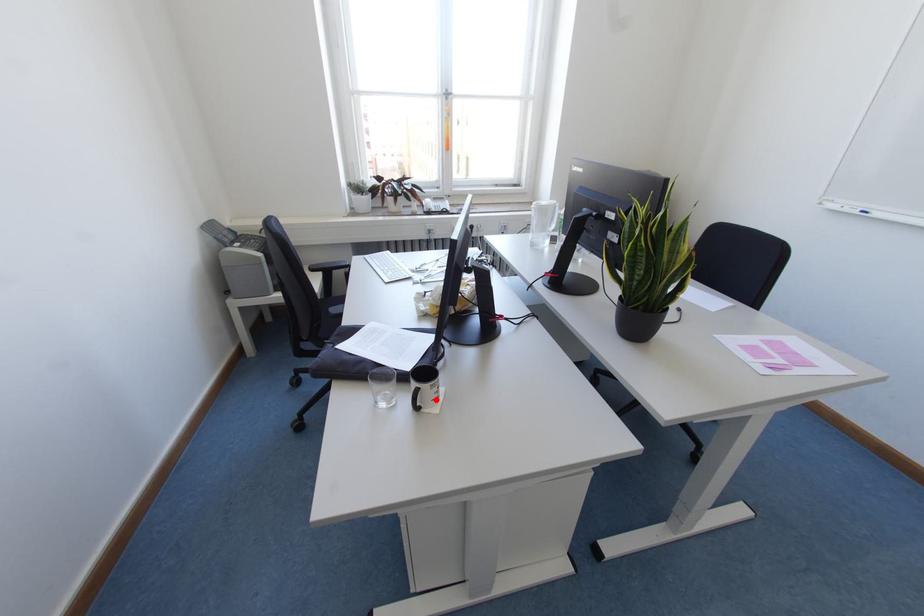
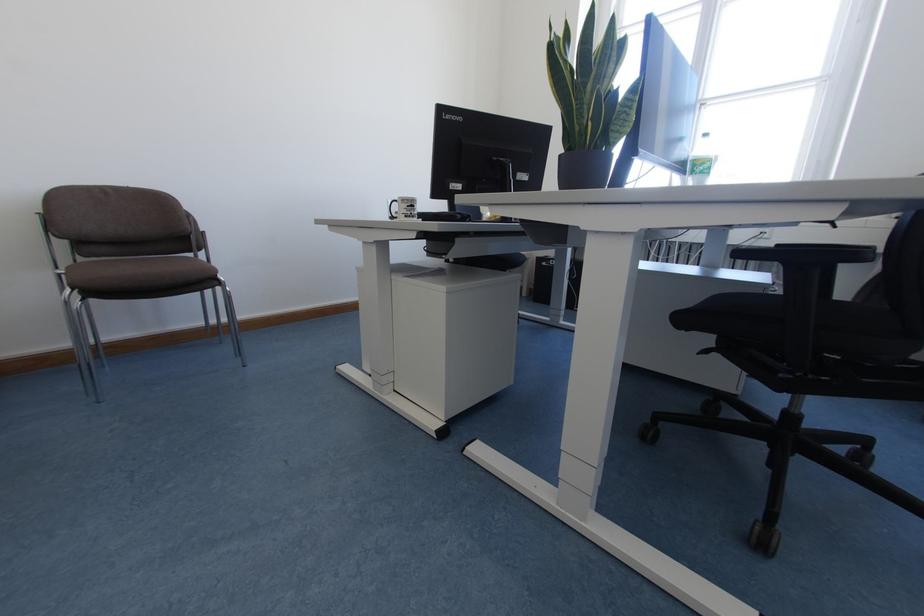
Find the pixel in the second image that matches the highlighted location in the first image.

(405, 216)